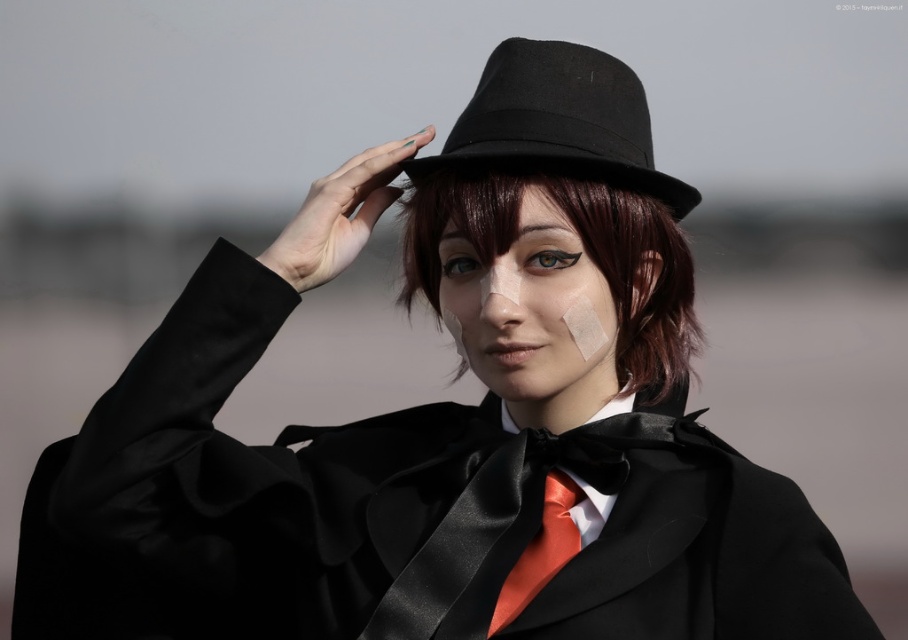
You are a photographer at an event and want to capture a clear shot of the dark brown silky hair at center and the black felt fedora at center. Based on their positions, which object should appear higher in the photo?

The dark brown silky hair at center is much taller than the black felt fedora at center, so it should appear higher in the photo.

You are a photographer at an event and notice a person with dark brown silky hair at center and a satin orange tie at center. Which object is positioned to the right side from your viewpoint?

The dark brown silky hair at center is positioned to the right of the satin orange tie at center from the photographer viewpoint.

You are a photographer standing at a certain distance from the person with dark brown silky hair at center. You need to capture a closeup shot of their face without using a zoom lens. What should you do?

Since the dark brown silky hair at center is 4.89 feet away from the camera, you should move closer to the subject until you are within the minimum focusing distance required for a closeup shot, ensuring the face is in clear focus.